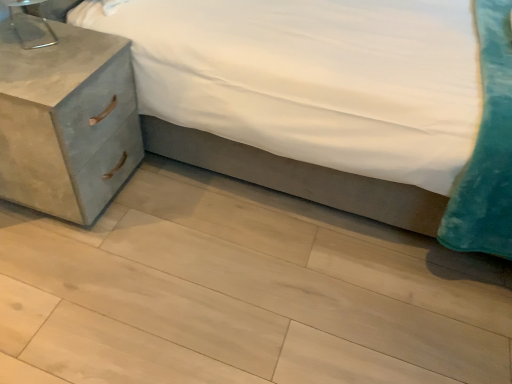
Question: Based on their sizes in the image, would you say velvet teal pillow at lower right is bigger or smaller than matte concrete nightstand at left?

Choices:
 (A) big
 (B) small

Answer: (A)

Question: From the image's perspective, is velvet teal pillow at lower right positioned above or below matte concrete nightstand at left?

Choices:
 (A) above
 (B) below

Answer: (A)

Question: Estimate the real-world distances between objects in this image. Which object is farther from the light wood floor at lower center?

Choices:
 (A) matte concrete nightstand at left
 (B) velvet teal pillow at lower right
 (C) metallic silver table lamp at upper left

Answer: (C)

Question: Which object is positioned closest to the velvet teal pillow at lower right?

Choices:
 (A) light wood floor at lower center
 (B) matte concrete nightstand at left
 (C) metallic silver table lamp at upper left

Answer: (A)